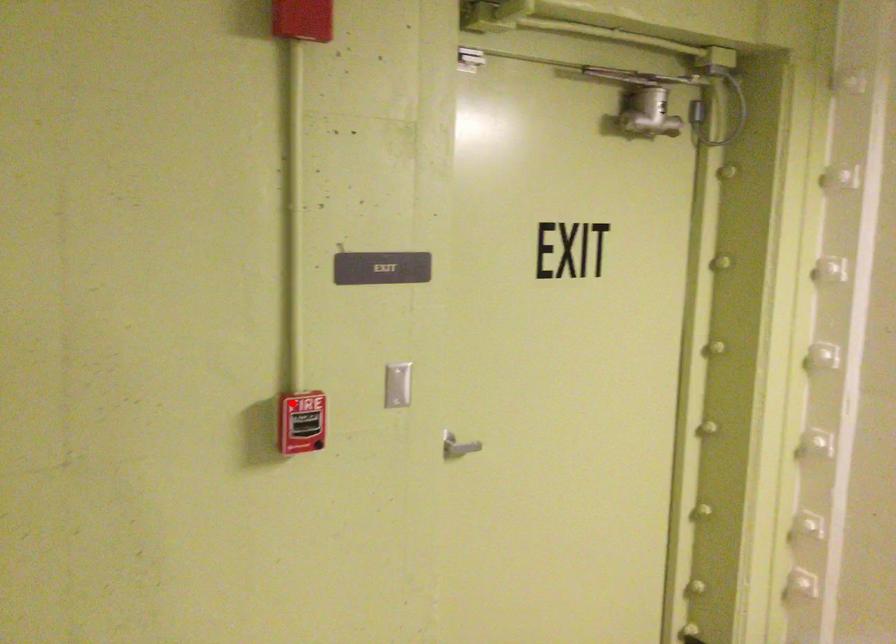
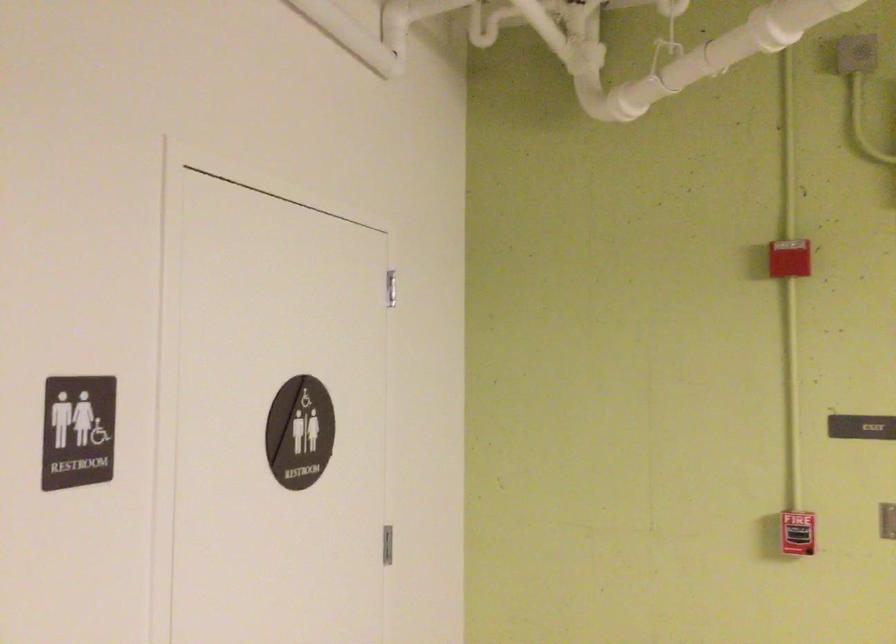
Question: I am providing you with two images of the same scene from different viewpoints. A red point is shown in image1. For the corresponding object point in image2, is it positioned nearer or farther from the camera?

Choices:
 (A) Nearer
 (B) Farther

Answer: (B)